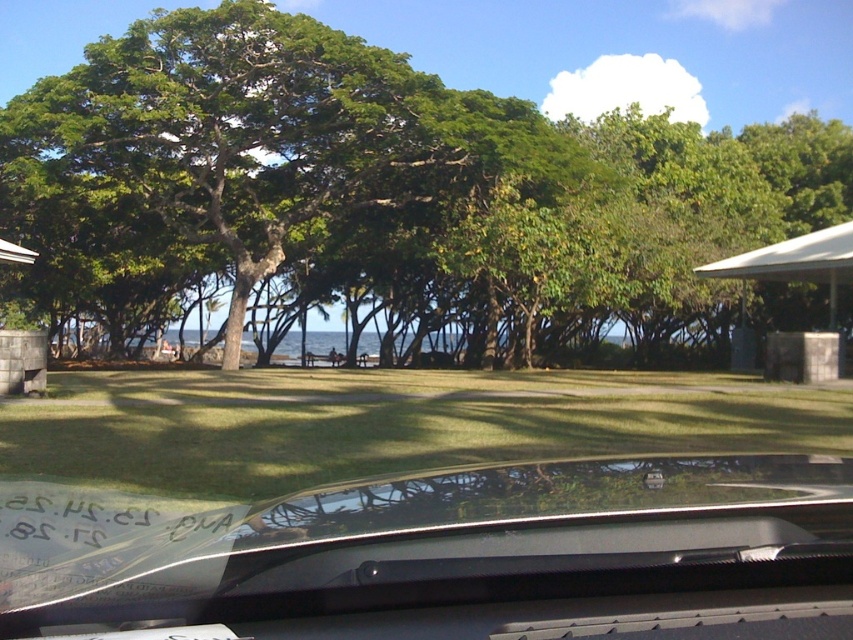
Question: Considering the relative positions of green grass at center and white plastic gazebo at right in the image provided, where is green grass at center located with respect to white plastic gazebo at right?

Choices:
 (A) above
 (B) below

Answer: (B)

Question: Which of the following is the farthest from the observer?

Choices:
 (A) (16, 604)
 (B) (842, 252)

Answer: (B)

Question: Does transparent glass windshield at lower center appear on the right side of green grass at center?

Choices:
 (A) yes
 (B) no

Answer: (B)

Question: Which of these objects is positioned closest to the transparent glass windshield at lower center?

Choices:
 (A) green grass at center
 (B) green leafy tree at center
 (C) white plastic gazebo at right

Answer: (A)

Question: Does green leafy tree at center lie behind green grass at center?

Choices:
 (A) yes
 (B) no

Answer: (A)

Question: Which object appears closest to the camera in this image?

Choices:
 (A) green leafy tree at center
 (B) green grass at center
 (C) transparent glass windshield at lower center

Answer: (C)